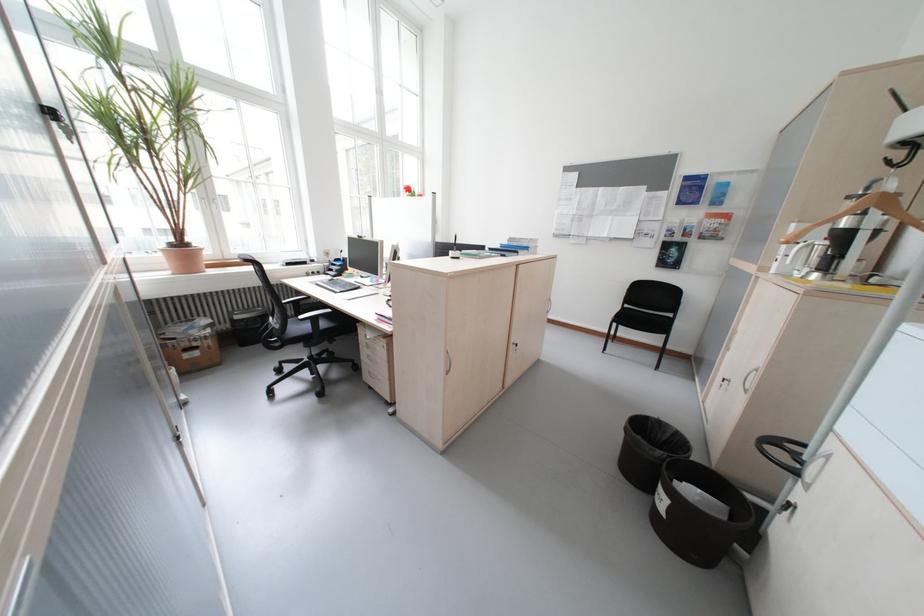
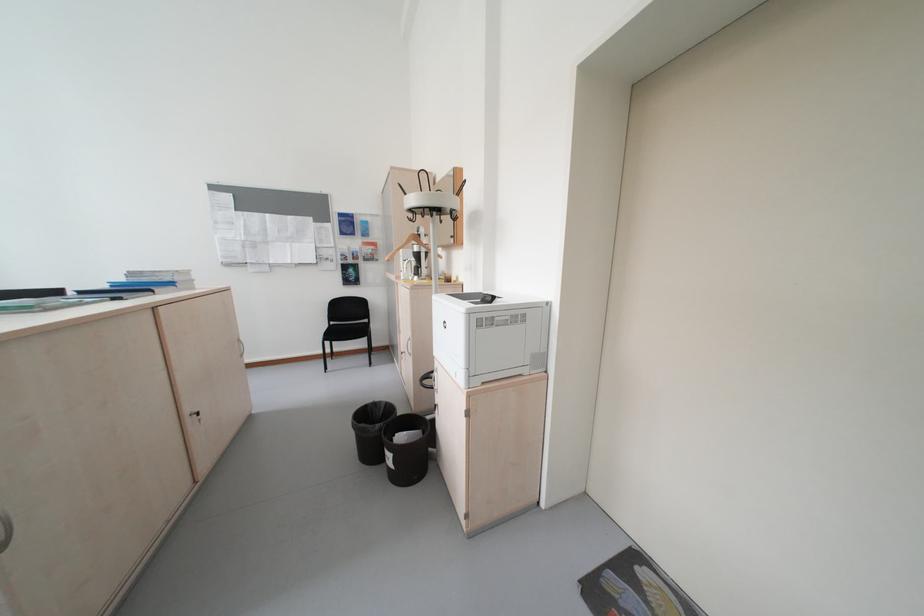
In the second image, find the point that corresponds to (x=526, y=245) in the first image.

(155, 281)